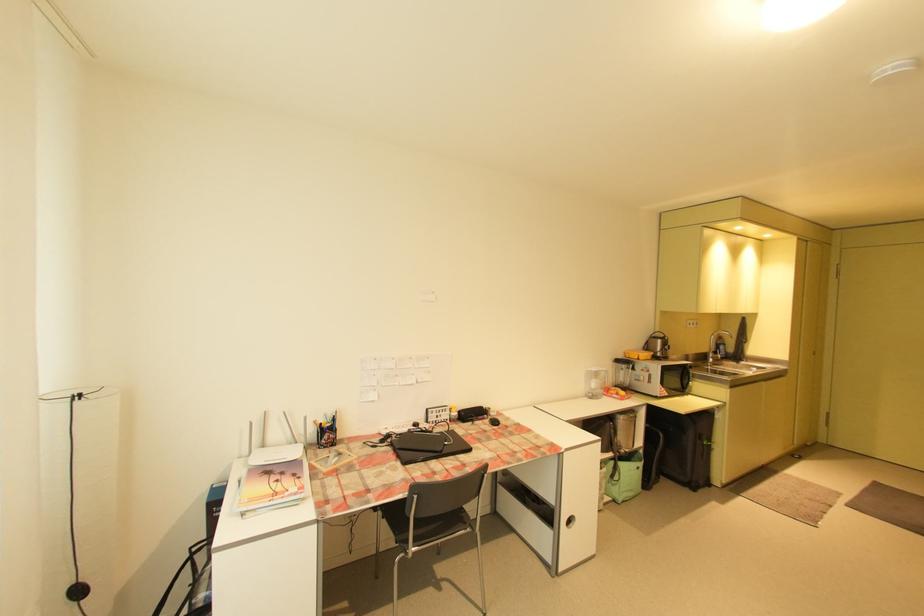
Where is `water filter pitcher`? The width and height of the screenshot is (924, 616). water filter pitcher is located at coordinates (621, 371).